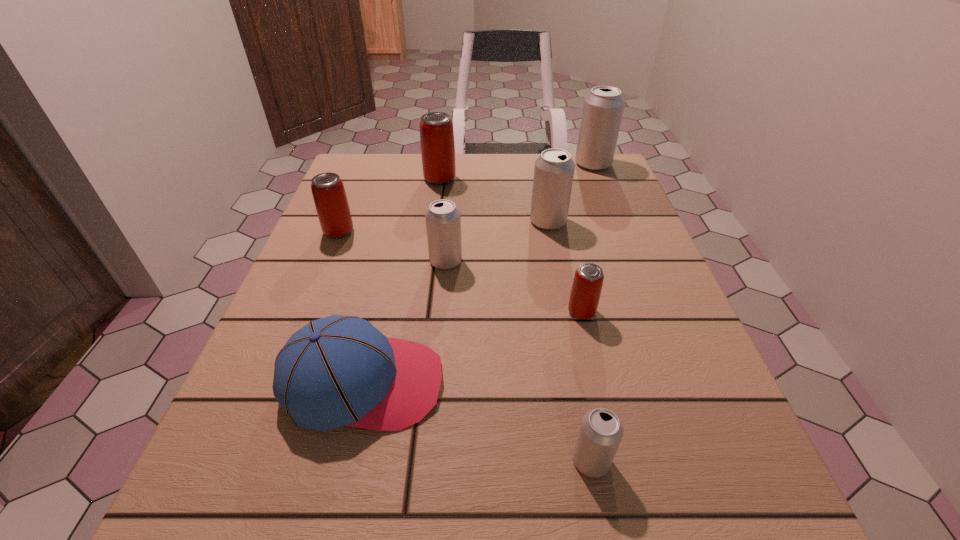
Where is `free space located on the front-facing side of the blue baseball cap`? free space located on the front-facing side of the blue baseball cap is located at coordinates (577, 383).

Identify the location of vacant space located on the back of the rightmost pink beer can. (560, 217).

This screenshot has width=960, height=540. What are the coordinates of `vacant region located 0.330m on the back of the nearest white beer can` in the screenshot? It's located at (557, 282).

Find the location of a particular element. The image size is (960, 540). beer can positioned at the left edge is located at coordinates (328, 191).

The width and height of the screenshot is (960, 540). In order to click on baseball cap positioned at the left edge in this screenshot , I will do `click(336, 371)`.

The height and width of the screenshot is (540, 960). What are the coordinates of `object that is at the far right corner` in the screenshot? It's located at (603, 107).

In the image, there is a desktop. Where is `vacant space at the far edge`? The width and height of the screenshot is (960, 540). vacant space at the far edge is located at coordinates (492, 191).

This screenshot has width=960, height=540. In order to click on vacant area at the near edge in this screenshot , I will do `click(438, 516)`.

Find the location of a particular element. The image size is (960, 540). vacant space at the left edge of the desktop is located at coordinates (242, 383).

The width and height of the screenshot is (960, 540). Identify the location of free space at the right edge of the desktop. (613, 245).